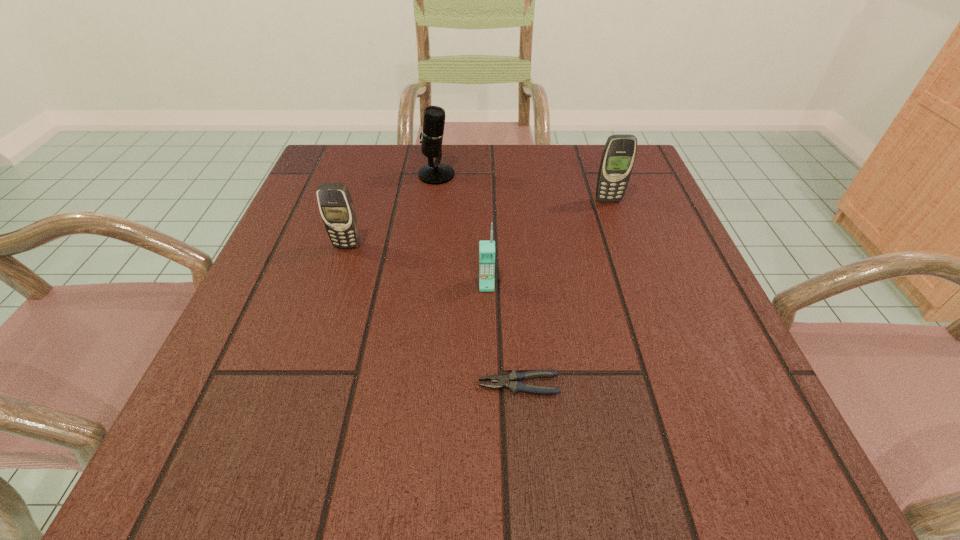
Locate an element on the screen. This screenshot has width=960, height=540. vacant space located 0.060m on the left of the farthest object is located at coordinates tap(393, 175).

You are a GUI agent. You are given a task and a screenshot of the screen. Output one action in this format:
    pyautogui.click(x=<x>, y=<y>)
    Task: Click on the free region located 0.370m on the screen of the rightmost object
    This screenshot has width=960, height=540.
    Given the screenshot: What is the action you would take?
    pyautogui.click(x=658, y=342)

At what (x,y) coordinates should I click in order to perform the action: click on blank area located 0.160m on the front face of the leftmost cellular telephone. Please return your answer as a coordinate pair (x, y). Looking at the image, I should click on (324, 314).

Where is `free space located on the keypad of the nearest cellular telephone`? free space located on the keypad of the nearest cellular telephone is located at coordinates (489, 416).

Where is `vacant space located 0.230m at the gripping part of the pliers`? The width and height of the screenshot is (960, 540). vacant space located 0.230m at the gripping part of the pliers is located at coordinates (319, 384).

This screenshot has height=540, width=960. Find the location of `vacant space positioned at the gripping part of the pliers`. vacant space positioned at the gripping part of the pliers is located at coordinates (402, 384).

Where is `free location located 0.260m at the gripping part of the pliers`? free location located 0.260m at the gripping part of the pliers is located at coordinates (298, 384).

Find the location of a particular element. The image size is (960, 540). microphone that is at the far edge is located at coordinates (434, 173).

Where is `cellular telephone situated at the far edge`? This screenshot has height=540, width=960. cellular telephone situated at the far edge is located at coordinates (619, 153).

You are a GUI agent. You are given a task and a screenshot of the screen. Output one action in this format:
    pyautogui.click(x=<x>, y=<y>)
    Task: Click on the object located in the left edge section of the desktop
    This screenshot has height=540, width=960.
    Given the screenshot: What is the action you would take?
    click(x=336, y=206)